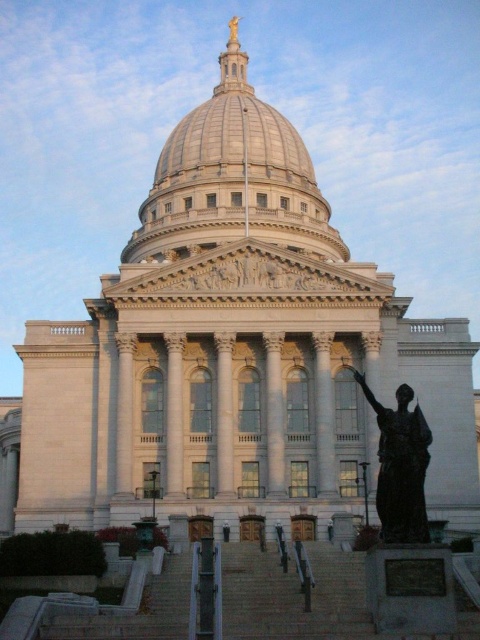
Question: Is shiny metallic dome at center further to camera compared to gray concrete stairs at center?

Choices:
 (A) no
 (B) yes

Answer: (B)

Question: Among these points, which one is nearest to the camera?

Choices:
 (A) (228, 596)
 (B) (242, 170)
 (C) (406, 525)

Answer: (C)

Question: Considering the real-world distances, which object is farthest from the bronze statue at right?

Choices:
 (A) shiny metallic dome at center
 (B) gray concrete stairs at center

Answer: (A)

Question: Does gray concrete stairs at center have a larger size compared to bronze statue at right?

Choices:
 (A) no
 (B) yes

Answer: (A)

Question: Considering the relative positions of shiny metallic dome at center and gray concrete stairs at center in the image provided, where is shiny metallic dome at center located with respect to gray concrete stairs at center?

Choices:
 (A) right
 (B) left

Answer: (B)

Question: Which object is farther from the camera taking this photo?

Choices:
 (A) shiny metallic dome at center
 (B) bronze statue at right

Answer: (A)